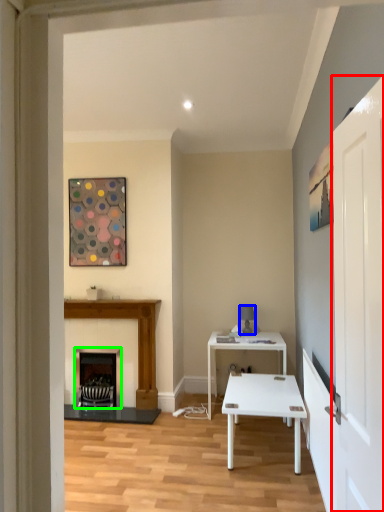
Question: Which is farther away from glass door (highlighted by a red box)? lamp (highlighted by a blue box) or fireplace (highlighted by a green box)?

Choices:
 (A) lamp
 (B) fireplace

Answer: (B)